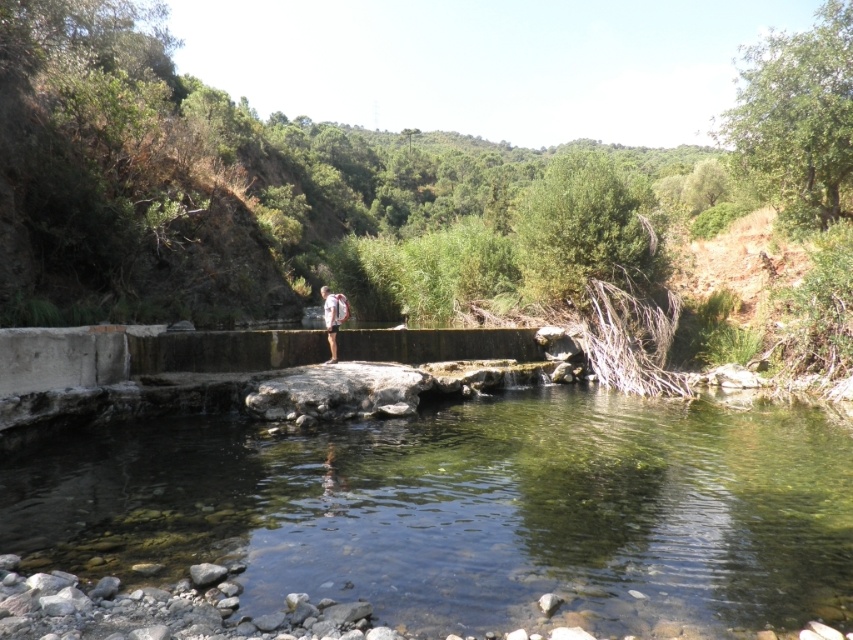
Is point (256, 486) positioned before point (326, 330)?

Yes, point (256, 486) is closer to viewer.

Is clear water at center above light brown fabric shorts at center?

No.

Between point (485, 442) and point (323, 288), which one is positioned in front?

Point (485, 442) is in front.

Image resolution: width=853 pixels, height=640 pixels. Find the location of `clear water at center`. clear water at center is located at coordinates pyautogui.click(x=468, y=508).